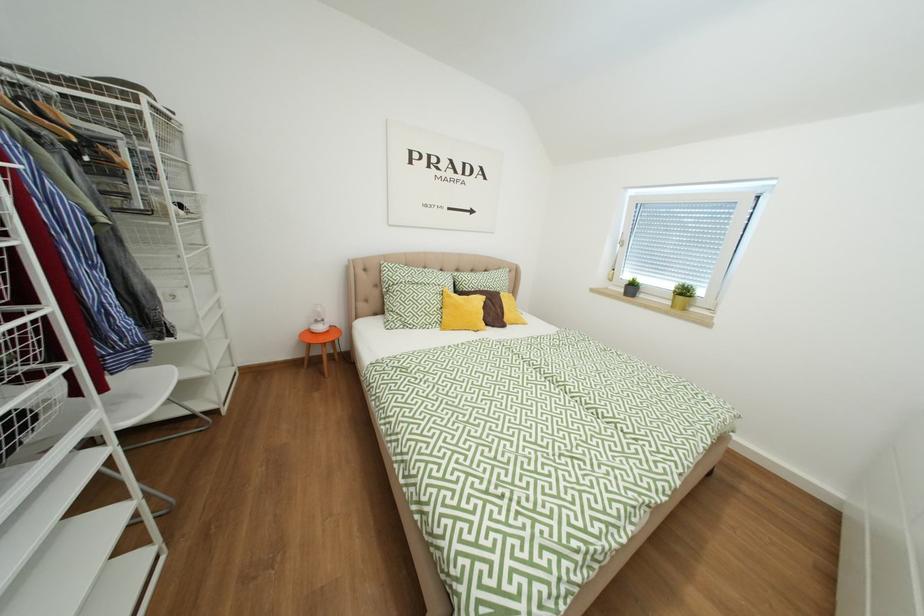
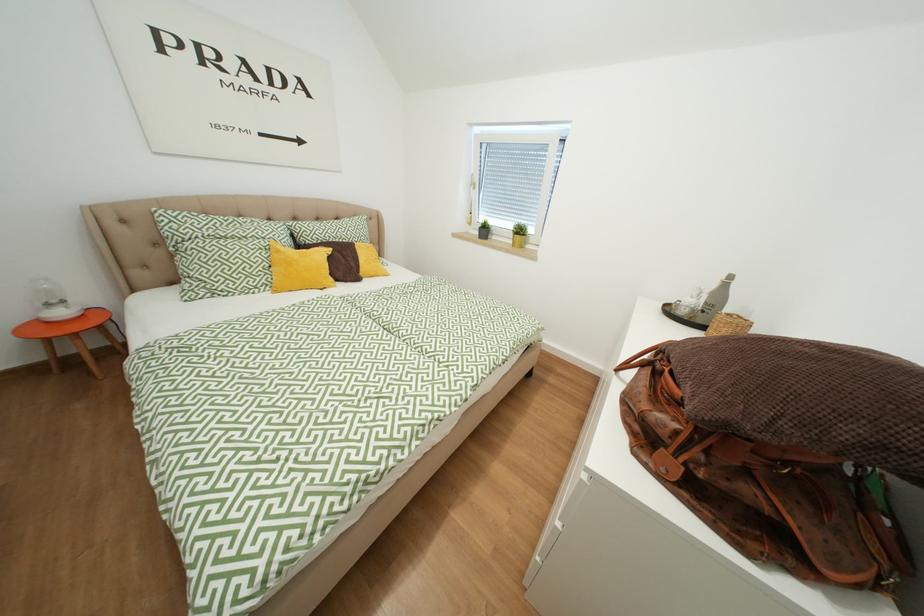
Question: The camera is either moving clockwise (left) or counter-clockwise (right) around the object. The first image is from the beginning of the video and the second image is from the end. Is the camera moving left or right when shooting the video?

Choices:
 (A) Left
 (B) Right

Answer: (A)